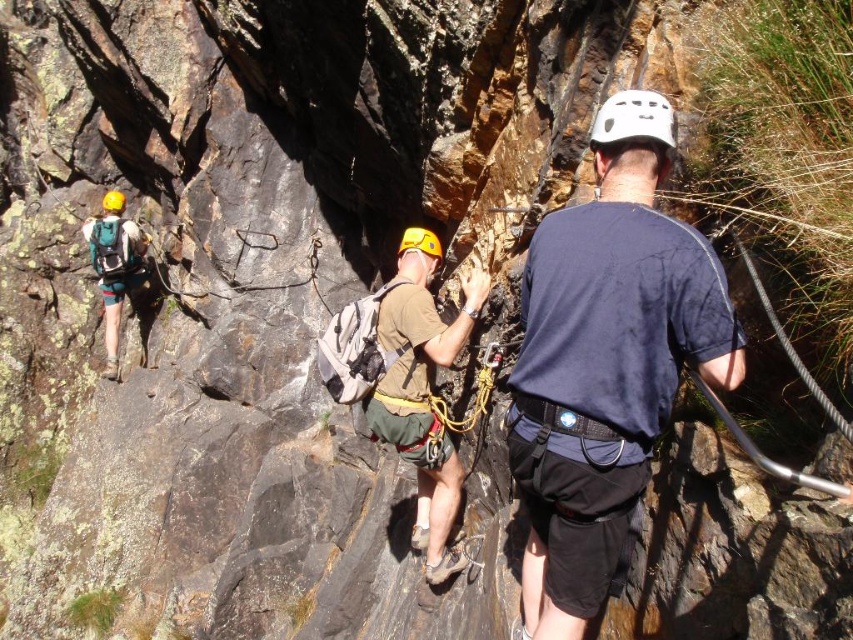
Question: Is dark blue t-shirt at center thinner than brown fabric shirt at center?

Choices:
 (A) yes
 (B) no

Answer: (A)

Question: Which point is farther from the camera taking this photo?

Choices:
 (A) (401, 320)
 (B) (639, 362)

Answer: (A)

Question: Is the position of dark blue t-shirt at center less distant than that of brown fabric shirt at center?

Choices:
 (A) no
 (B) yes

Answer: (B)

Question: Is dark blue t-shirt at center thinner than brown fabric shirt at center?

Choices:
 (A) no
 (B) yes

Answer: (B)

Question: Which object appears closest to the camera in this image?

Choices:
 (A) dark blue t-shirt at center
 (B) brown fabric shirt at center

Answer: (A)